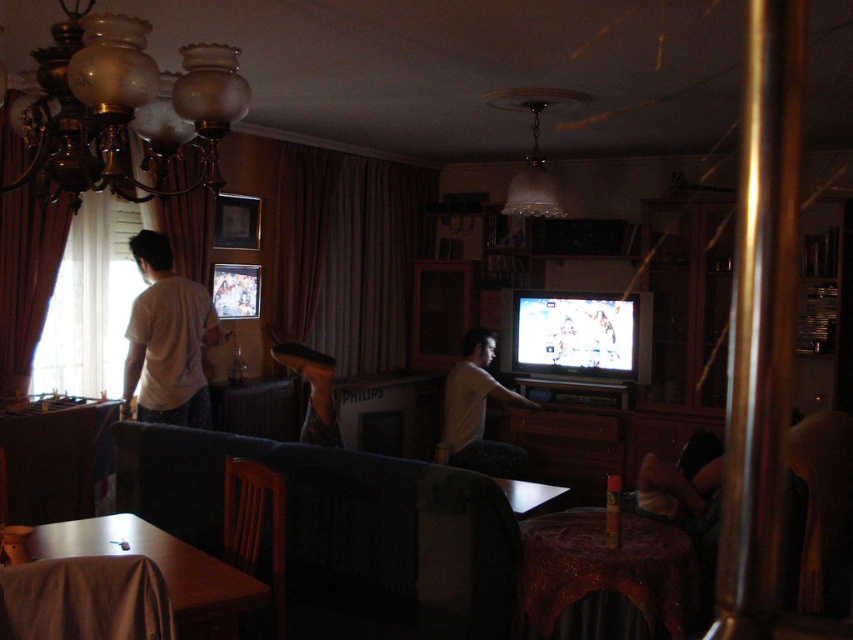
Question: Which object is farther from the camera taking this photo?

Choices:
 (A) white cotton shirt at left
 (B) brown fabric curtain at left
 (C) dark blue fabric couch at lower center
 (D) bronze glass chandelier at upper left

Answer: (A)

Question: Where is dark gray fabric armchair at lower left located in relation to white cotton shirt at left in the image?

Choices:
 (A) above
 (B) below

Answer: (B)

Question: Among these points, which one is nearest to the camera?

Choices:
 (A) (282, 500)
 (B) (338, 600)

Answer: (A)

Question: Does bronze glass chandelier at upper left appear on the left side of white cotton shirt at left?

Choices:
 (A) no
 (B) yes

Answer: (A)

Question: Among these points, which one is nearest to the camera?

Choices:
 (A) (492, 394)
 (B) (172, 125)

Answer: (B)

Question: In this image, where is bronze glass chandelier at upper left located relative to white cotton shirt at left?

Choices:
 (A) right
 (B) left

Answer: (A)